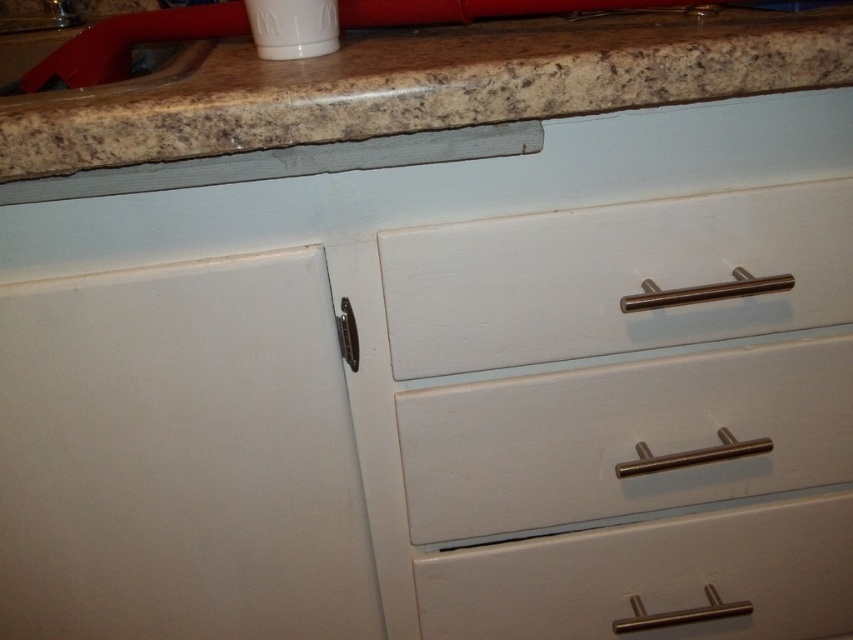
You are organizing the kitchen and notice two drawers labeled white matte drawer at center and matte white drawer at center. Which drawer is closer to you?

The white matte drawer at center is closer to you because it is in front of the matte white drawer at center.

You are a kitchen designer planning to install a new appliance between the white matte drawer at center and the matte white drawer at center. What is the minimum width this appliance should be to fit snugly between them?

The minimum width should be at least 3.66 inches to fit snugly between the white matte drawer at center and the matte white drawer at center.

You are standing in front of the kitchen cabinet and countertop. There are two points marked on the image. The first point is at coordinates point (251, 106) and the second is at point (509, 588). Which point is closer to you?

Point (251, 106) is in front of point (509, 588), so it is closer to you.